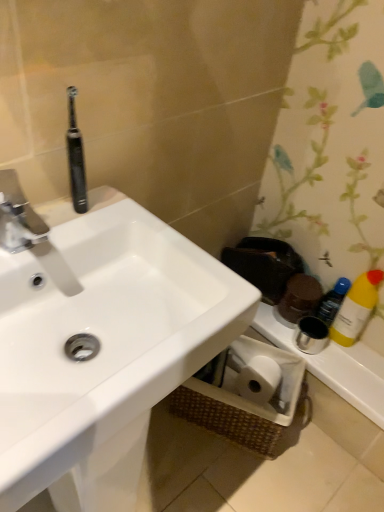
Question: From the image's perspective, is white glossy sink at upper left on top of black rubber toothbrush at upper left?

Choices:
 (A) yes
 (B) no

Answer: (B)

Question: Is white glossy sink at upper left far from black rubber toothbrush at upper left?

Choices:
 (A) yes
 (B) no

Answer: (B)

Question: From the image's perspective, is white glossy sink at upper left under black rubber toothbrush at upper left?

Choices:
 (A) yes
 (B) no

Answer: (A)

Question: Can you confirm if white glossy sink at upper left is bigger than black rubber toothbrush at upper left?

Choices:
 (A) yes
 (B) no

Answer: (A)

Question: Does white glossy sink at upper left lie in front of black rubber toothbrush at upper left?

Choices:
 (A) no
 (B) yes

Answer: (B)

Question: Considering the positions of silver metallic faucet at upper left and white glossy sink at upper left in the image, is silver metallic faucet at upper left wider or thinner than white glossy sink at upper left?

Choices:
 (A) thin
 (B) wide

Answer: (A)

Question: Considering the positions of point (6, 209) and point (105, 246), is point (6, 209) closer or farther from the camera than point (105, 246)?

Choices:
 (A) farther
 (B) closer

Answer: (B)

Question: Relative to white glossy sink at upper left, is silver metallic faucet at upper left in front or behind?

Choices:
 (A) behind
 (B) front

Answer: (A)

Question: Visually, is silver metallic faucet at upper left positioned to the left or to the right of white glossy sink at upper left?

Choices:
 (A) left
 (B) right

Answer: (A)

Question: Is white glossy sink at upper left taller or shorter than silver metallic faucet at upper left?

Choices:
 (A) short
 (B) tall

Answer: (B)

Question: Considering the relative positions of white glossy sink at upper left and silver metallic faucet at upper left in the image provided, is white glossy sink at upper left to the left or to the right of silver metallic faucet at upper left?

Choices:
 (A) right
 (B) left

Answer: (A)

Question: Relative to silver metallic faucet at upper left, is white glossy sink at upper left in front or behind?

Choices:
 (A) behind
 (B) front

Answer: (B)

Question: Considering the positions of white glossy sink at upper left and silver metallic faucet at upper left in the image, is white glossy sink at upper left wider or thinner than silver metallic faucet at upper left?

Choices:
 (A) thin
 (B) wide

Answer: (B)

Question: From the image's perspective, is silver metallic faucet at upper left above or below yellow plastic bottle at right?

Choices:
 (A) above
 (B) below

Answer: (A)

Question: Considering the positions of silver metallic faucet at upper left and yellow plastic bottle at right in the image, is silver metallic faucet at upper left bigger or smaller than yellow plastic bottle at right?

Choices:
 (A) big
 (B) small

Answer: (B)